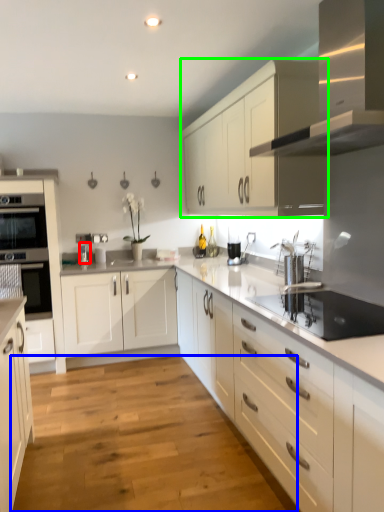
Question: Estimate the real-world distances between objects in this image. Which object is farther from faucet (highlighted by a red box), plain (highlighted by a blue box) or cabinetry (highlighted by a green box)?

Choices:
 (A) plain
 (B) cabinetry

Answer: (A)